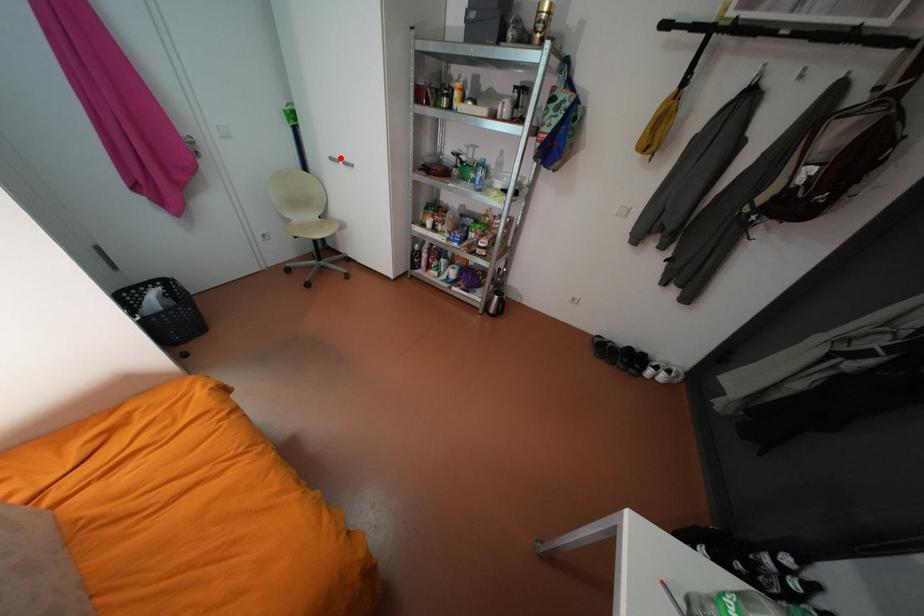
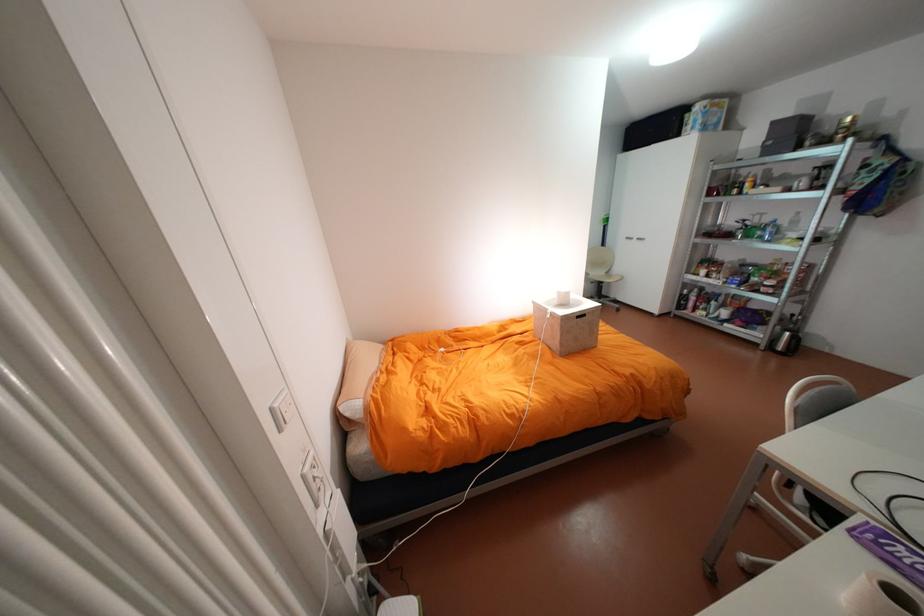
Where in the second image is the point corresponding to the highlighted location from the first image?

(636, 237)